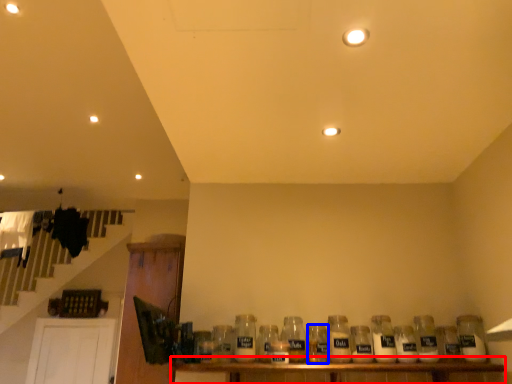
Question: Which of the following is the closest to the observer, table (highlighted by a red box) or bottle (highlighted by a blue box)?

Choices:
 (A) table
 (B) bottle

Answer: (A)